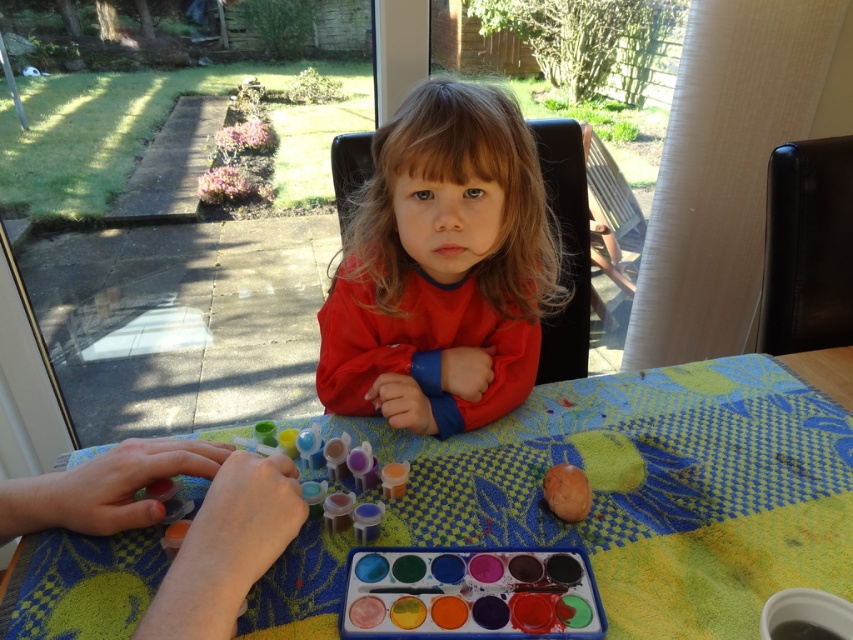
Is red matte hair at center thinner than matte brown egg at lower center?

Incorrect, red matte hair at center's width is not less than matte brown egg at lower center's.

Consider the image. Can you confirm if red matte hair at center is bigger than matte brown egg at lower center?

Indeed, red matte hair at center has a larger size compared to matte brown egg at lower center.

You are a GUI agent. You are given a task and a screenshot of the screen. Output one action in this format:
    pyautogui.click(x=<x>, y=<y>)
    Task: Click on the red matte hair at center
    Image resolution: width=853 pixels, height=640 pixels.
    Given the screenshot: What is the action you would take?
    pyautogui.click(x=440, y=268)

Which is behind, point (706, 449) or point (329, 392)?

Point (329, 392)

Based on the photo, is textured fabric table at center above red matte hair at center?

Actually, textured fabric table at center is below red matte hair at center.

Locate an element on the screen. The image size is (853, 640). textured fabric table at center is located at coordinates (651, 490).

Based on the photo, does red matte hair at center have a greater height compared to watercolor paint palette at center?

Yes.

Is red matte hair at center above watercolor paint palette at center?

Indeed, red matte hair at center is positioned over watercolor paint palette at center.

Where is `red matte hair at center`? The width and height of the screenshot is (853, 640). red matte hair at center is located at coordinates (440, 268).